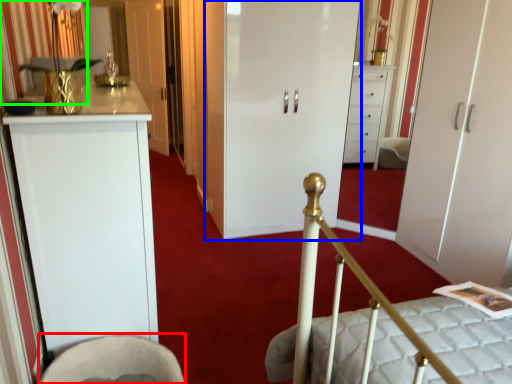
Question: Considering the real-world distances, which object is farthest from rocking chair (highlighted by a red box)? door (highlighted by a blue box) or curtain (highlighted by a green box)?

Choices:
 (A) door
 (B) curtain

Answer: (A)